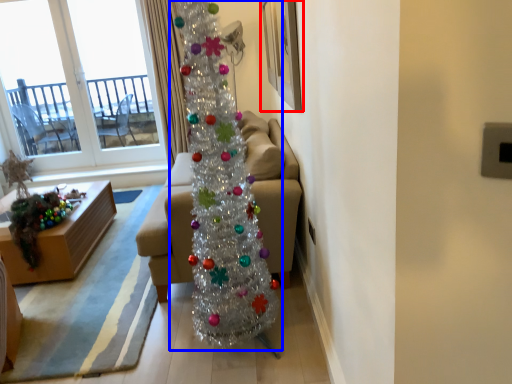
Question: Which of the following is the farthest to the observer, picture frame (highlighted by a red box) or christmas tree (highlighted by a blue box)?

Choices:
 (A) picture frame
 (B) christmas tree

Answer: (A)